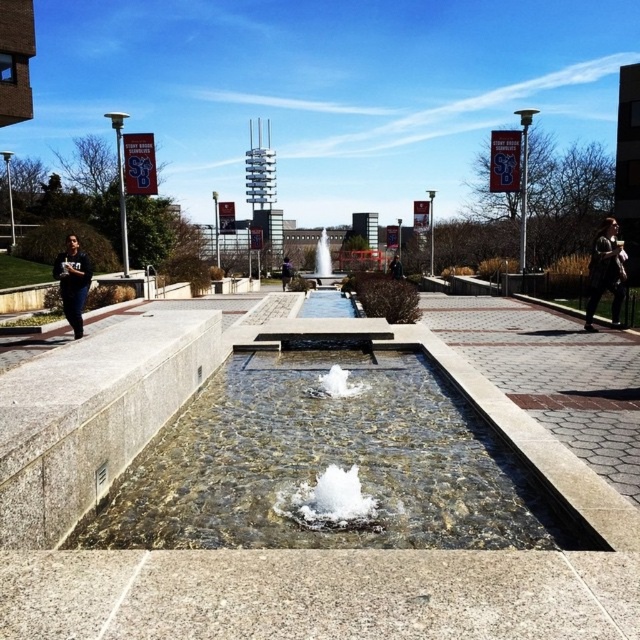
Between point (54, 264) and point (284, 288), which one is positioned behind?

The point (284, 288) is behind.

Is dark blue jeans at left further to camera compared to black fabric jacket at center?

No, it is in front of black fabric jacket at center.

Identify the location of dark blue jeans at left. The height and width of the screenshot is (640, 640). (72, 282).

Between dark brown leather jacket at right and black fabric person at center, which one is positioned lower?

dark brown leather jacket at right is lower down.

Is dark brown leather jacket at right wider than black fabric person at center?

Incorrect, dark brown leather jacket at right's width does not surpass black fabric person at center's.

Between point (616, 253) and point (400, 262), which one is positioned in front?

Point (616, 253) is in front.

Where is `dark brown leather jacket at right`? This screenshot has width=640, height=640. dark brown leather jacket at right is located at coordinates (605, 273).

Based on the photo, does clear glass water at center have a smaller size compared to dark blue jeans at left?

Incorrect, clear glass water at center is not smaller in size than dark blue jeans at left.

Is point (184, 436) positioned before point (76, 284)?

Yes, point (184, 436) is closer to viewer.

Does point (144, 529) come in front of point (77, 321)?

Yes, it is in front of point (77, 321).

Locate an element on the screen. The width and height of the screenshot is (640, 640). clear glass water at center is located at coordinates (326, 465).